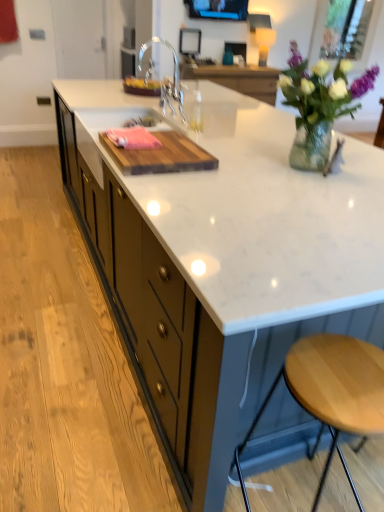
Question: From the image's perspective, is matte black tv at upper center, positioned as the first window screen in left-to-right order, above or below light brown wood stool at lower right?

Choices:
 (A) below
 (B) above

Answer: (B)

Question: In the image, is matte black tv at upper center, which appears as the second window screen when viewed from the back, positioned in front of or behind light brown wood stool at lower right?

Choices:
 (A) behind
 (B) front

Answer: (A)

Question: Considering the real-world distances, which object is farthest from the clear glass vase at upper right?

Choices:
 (A) white marble countertop at center
 (B) clear glass window screen at upper right, the first window screen from the back
 (C) wooden cutting board at center
 (D) matte black tv at upper center, which appears as the second window screen when viewed from the back
 (E) chrome metallic faucet at center

Answer: (D)

Question: Based on their relative distances, which object is nearer to the matte black tv at upper center, arranged as the second window screen when viewed from the right?

Choices:
 (A) clear glass window screen at upper right, marked as the first window screen in a right-to-left arrangement
 (B) white marble countertop at center
 (C) wooden cutting board at center
 (D) chrome metallic faucet at center
 (E) light brown wood stool at lower right

Answer: (A)